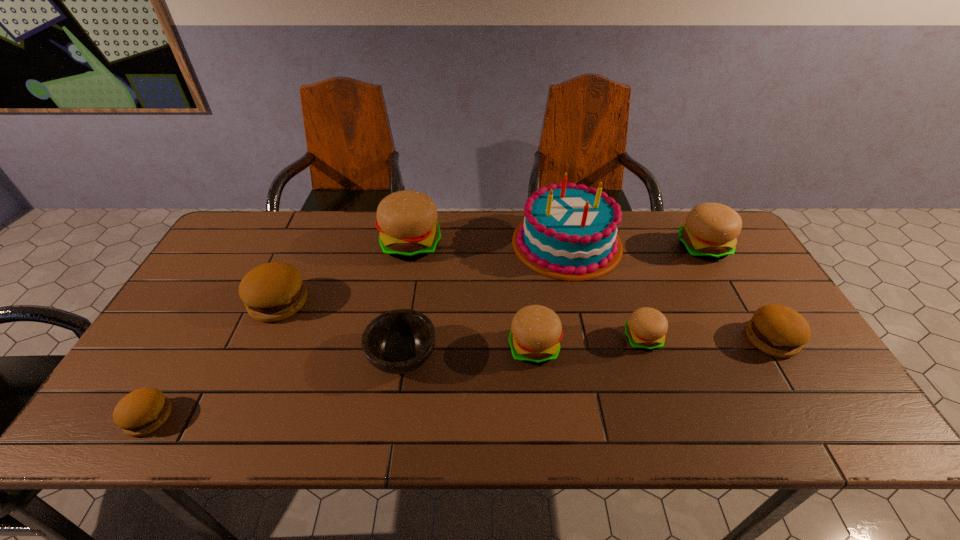
The width and height of the screenshot is (960, 540). In order to click on birthday cake in this screenshot , I will do `click(569, 232)`.

The height and width of the screenshot is (540, 960). What are the coordinates of `blue birthday cake` in the screenshot? It's located at (569, 232).

Image resolution: width=960 pixels, height=540 pixels. I want to click on the biggest beige hamburger, so click(x=407, y=220).

I want to click on the tallest hamburger, so click(407, 220).

I want to click on the rightmost beige hamburger, so click(x=710, y=231).

This screenshot has width=960, height=540. What are the coordinates of `the seventh shortest object` in the screenshot? It's located at (710, 231).

Locate an element on the screen. Image resolution: width=960 pixels, height=540 pixels. the fourth hamburger from right to left is located at coordinates (536, 330).

At what (x,y) coordinates should I click in order to perform the action: click on the third beige hamburger from right to left. Please return your answer as a coordinate pair (x, y). Looking at the image, I should click on (536, 330).

Where is `the second brown hamburger from left to right`? the second brown hamburger from left to right is located at coordinates (274, 291).

Where is `the eighth object from right to left`? the eighth object from right to left is located at coordinates (274, 291).